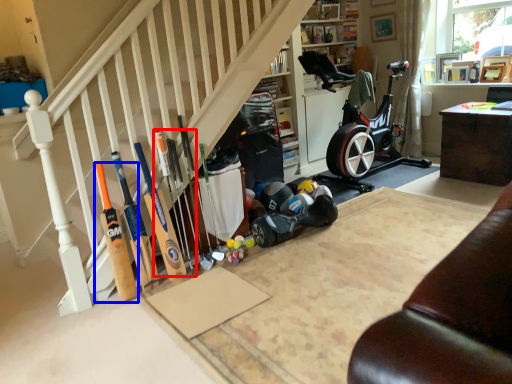
Question: Among these objects, which one is farthest to the camera, baseball bat (highlighted by a red box) or baseball bat (highlighted by a blue box)?

Choices:
 (A) baseball bat
 (B) baseball bat

Answer: (A)